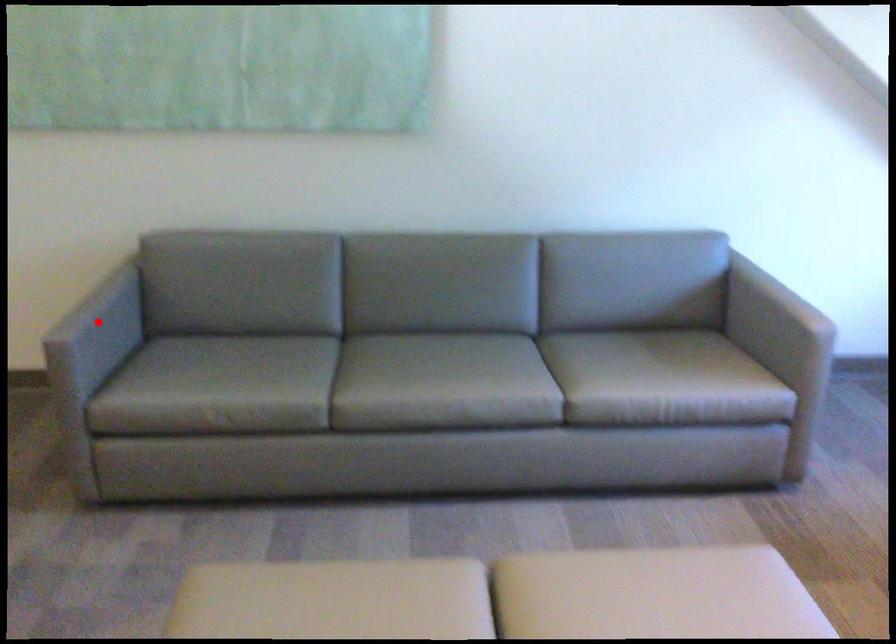
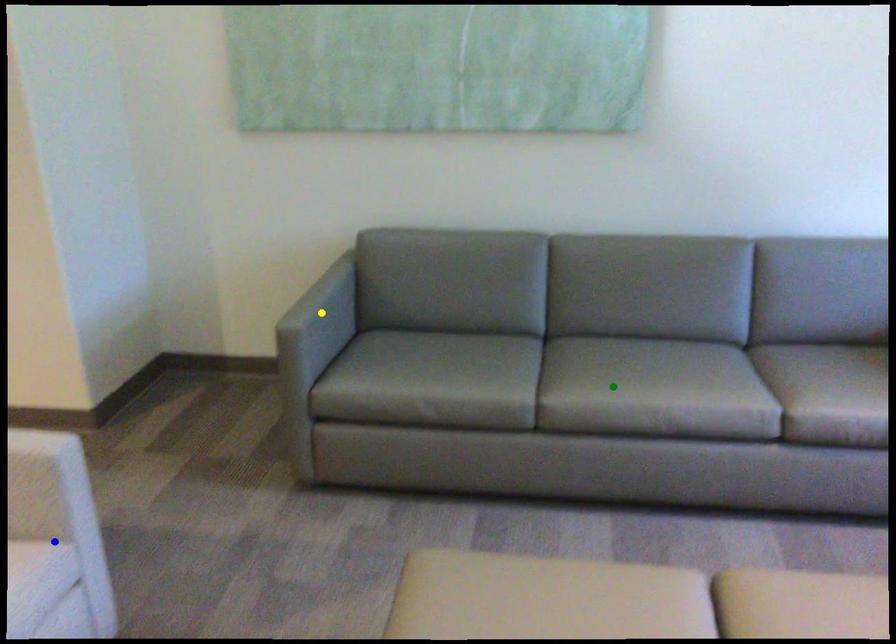
Question: I am providing you with two images of the same scene from different viewpoints. A red point is marked on the first image. You are given multiple points on the second image. Which spot in image 2 lines up with the point in image 1?

Choices:
 (A) blue point
 (B) yellow point
 (C) green point

Answer: (B)